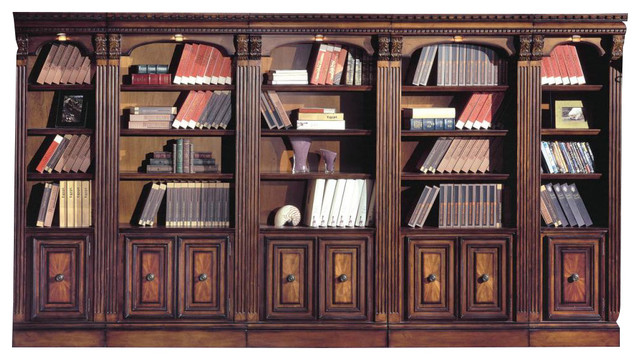
The height and width of the screenshot is (360, 640). In order to click on bookcases in this screenshot , I will do `click(601, 16)`, `click(493, 29)`, `click(347, 25)`, `click(48, 25)`.